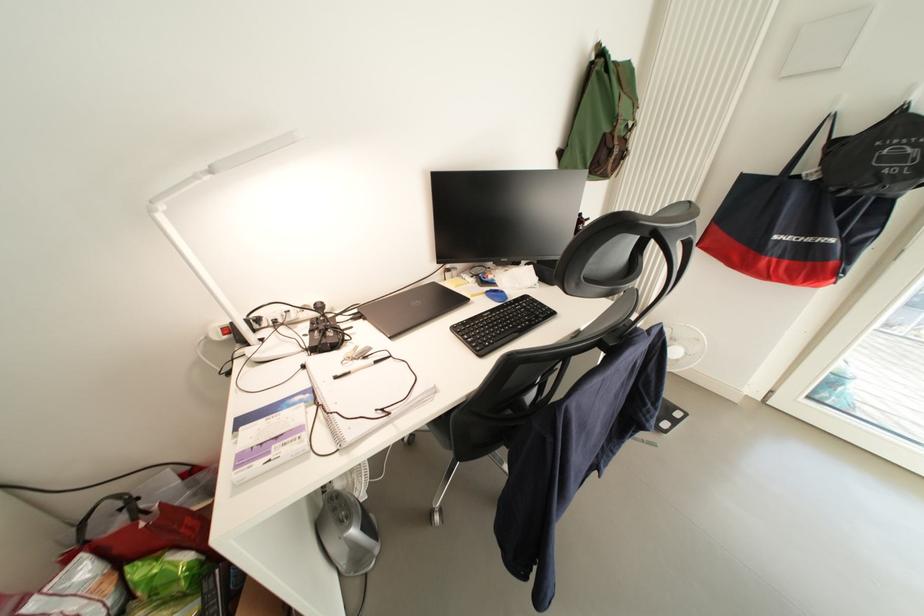
Image resolution: width=924 pixels, height=616 pixels. I want to click on silver fan buttons, so click(669, 419).